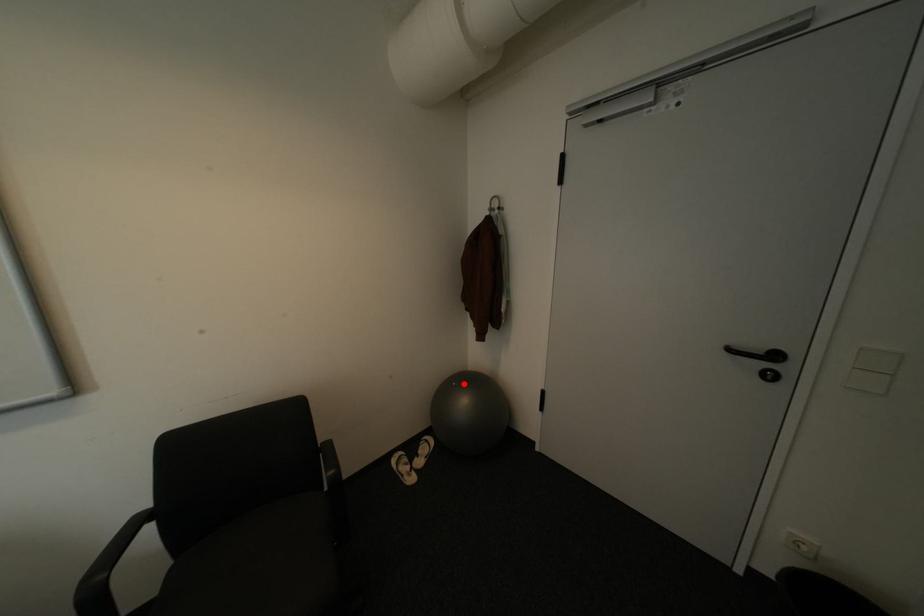
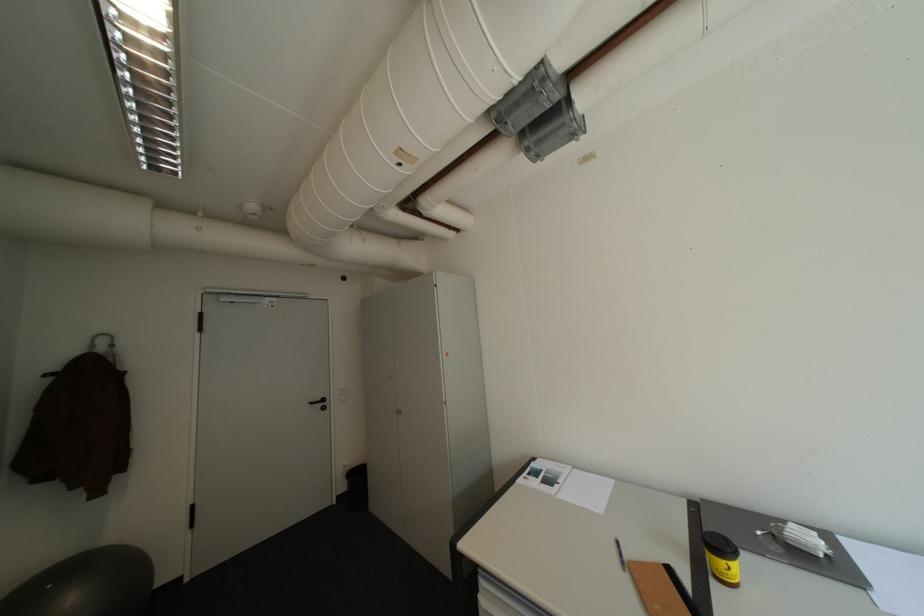
Question: I am providing you with two images of the same scene from different viewpoints. A red point is shown in image1. For the corresponding object point in image2, is it positioned nearer or farther from the camera?

Choices:
 (A) Nearer
 (B) Farther

Answer: (B)